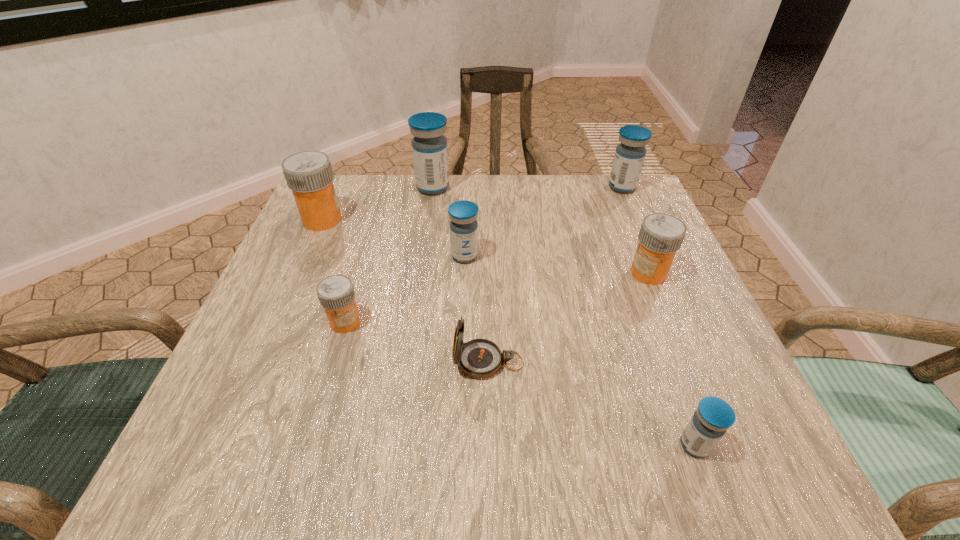
Locate an element on the screen. The width and height of the screenshot is (960, 540). the sixth medicine from right to left is located at coordinates (336, 294).

In order to click on the second orange medicine from left to right in this screenshot , I will do `click(336, 294)`.

I want to click on the smallest blue medicine, so click(x=709, y=423).

Image resolution: width=960 pixels, height=540 pixels. In order to click on the nearest object in this screenshot , I will do `click(709, 423)`.

I want to click on vacant area situated 0.350m on the front of the sixth object from right to left, so click(x=417, y=298).

Where is `blank space located on the label side of the farthest orange medicine`? The height and width of the screenshot is (540, 960). blank space located on the label side of the farthest orange medicine is located at coordinates (468, 220).

The image size is (960, 540). Identify the location of vacant space located 0.190m on the front of the third smallest blue medicine. [646, 243].

Identify the location of free space located on the label side of the second smallest orange medicine. The height and width of the screenshot is (540, 960). (589, 273).

You are a GUI agent. You are given a task and a screenshot of the screen. Output one action in this format:
    pyautogui.click(x=<x>, y=<y>)
    Task: Click on the free space located on the label side of the second smallest orange medicine
    This screenshot has width=960, height=540.
    Given the screenshot: What is the action you would take?
    point(564,273)

Locate an element on the screen. Image resolution: width=960 pixels, height=540 pixels. blank area located on the label side of the second smallest orange medicine is located at coordinates (446, 273).